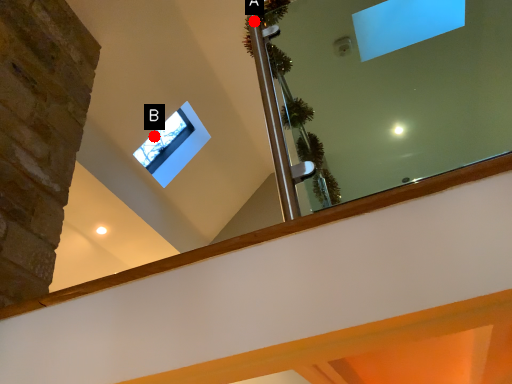
Question: Two points are circled on the image, labeled by A and B beside each circle. Which point is closer to the camera taking this photo?

Choices:
 (A) A is closer
 (B) B is closer

Answer: (A)